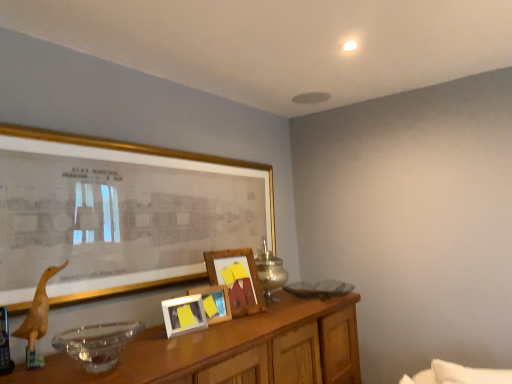
Question: Is wooden picture frame at center, which is the 2th picture frame in back-to-front order, further to the viewer compared to wooden table at lower center?

Choices:
 (A) yes
 (B) no

Answer: (A)

Question: Is wooden picture frame at center, the third picture frame positioned from the front, at the right side of wooden table at lower center?

Choices:
 (A) yes
 (B) no

Answer: (B)

Question: Is wooden picture frame at center, the third picture frame positioned from the front, turned away from wooden table at lower center?

Choices:
 (A) no
 (B) yes

Answer: (A)

Question: Is the position of wooden picture frame at center, which is the 2th picture frame in back-to-front order, less distant than that of wooden table at lower center?

Choices:
 (A) no
 (B) yes

Answer: (A)

Question: Can you confirm if wooden picture frame at center, which is the 2th picture frame in back-to-front order, is positioned to the left of wooden table at lower center?

Choices:
 (A) no
 (B) yes

Answer: (B)

Question: From the image's perspective, is wooden picture frame at center, the third picture frame positioned from the front, on top of wooden table at lower center?

Choices:
 (A) no
 (B) yes

Answer: (B)

Question: Does metallic silver table lamp at center have a larger size compared to wooden duckling at left?

Choices:
 (A) no
 (B) yes

Answer: (B)

Question: Considering the relative positions of metallic silver table lamp at center and wooden duckling at left in the image provided, is metallic silver table lamp at center in front of wooden duckling at left?

Choices:
 (A) yes
 (B) no

Answer: (B)

Question: Is metallic silver table lamp at center taller than wooden duckling at left?

Choices:
 (A) yes
 (B) no

Answer: (A)

Question: Does metallic silver table lamp at center have a lesser height compared to wooden duckling at left?

Choices:
 (A) yes
 (B) no

Answer: (B)

Question: Could you tell me if metallic silver table lamp at center is turned towards wooden duckling at left?

Choices:
 (A) yes
 (B) no

Answer: (B)

Question: Is the depth of metallic silver table lamp at center greater than that of wooden duckling at left?

Choices:
 (A) yes
 (B) no

Answer: (A)

Question: Is matte gold picture frame at upper left, which ranks as the 4th picture frame in back-to-front order, facing away from metallic silver table lamp at center?

Choices:
 (A) yes
 (B) no

Answer: (A)